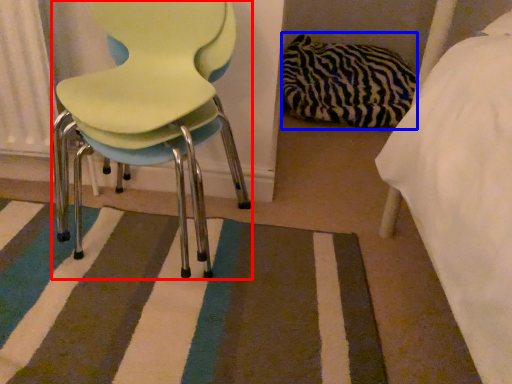
Question: Which object appears farthest to the camera in this image, chair (highlighted by a red box) or material (highlighted by a blue box)?

Choices:
 (A) chair
 (B) material

Answer: (B)